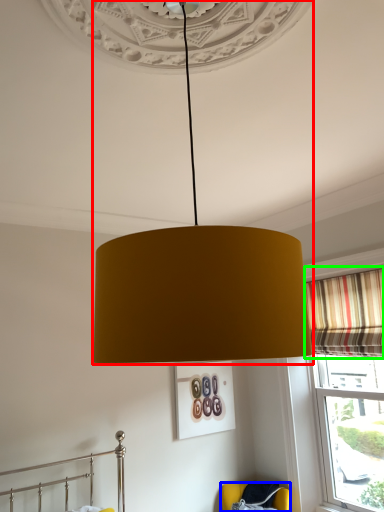
Question: Based on their relative distances, which object is farther from lamp (highlighted by a red box)? Choose from furniture (highlighted by a blue box) and curtain (highlighted by a green box).

Choices:
 (A) furniture
 (B) curtain

Answer: (A)